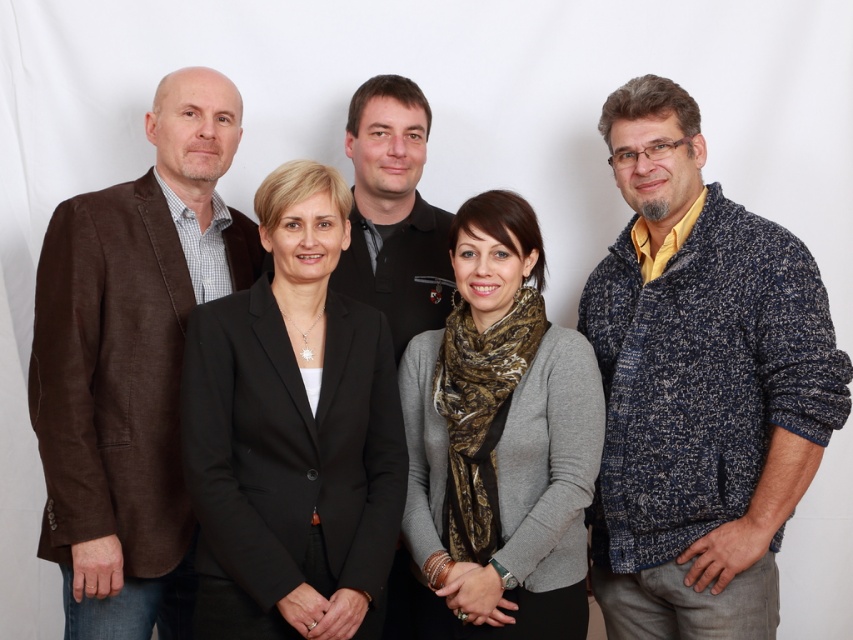
You are a photographer who needs to adjust the lighting to highlight the brown linen blazer at left. Based on the coordinates provided, where should you position the light source to ensure it directly illuminates the blazer?

The brown linen blazer at left is positioned at coordinates point (132, 364), so the light source should be directed towards that specific point to ensure it directly illuminates the blazer.

Based on the photo, you are a photographer preparing to take a group photo. You notice two accessories in the scene, the knitted blue sweater at right and the gray textured scarf at center. Which accessory is taller?

The knitted blue sweater at right is taller than the gray textured scarf at center.

You are a photographer trying to capture a closeup of the brown linen blazer at left and the gray textured scarf at center. Given that your camera can only focus on objects within a 20 inch range, will you be able to capture both items in focus?

The brown linen blazer at left and gray textured scarf at center are 23.16 inches apart from each other. Since the camera can only focus within a 20 inch range, the distance between them exceeds the focus range, so you won